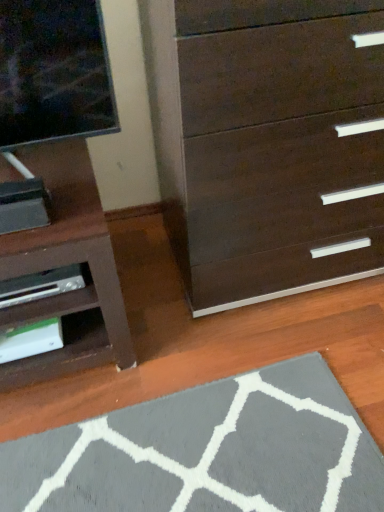
Find the location of a particular element. Image resolution: width=384 pixels, height=512 pixels. free region under gray soft rug at lower center (from a real-world perspective) is located at coordinates (228, 446).